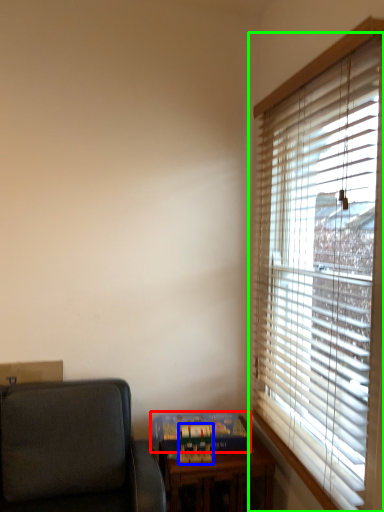
Question: Considering the real-world distances, which object is farthest from paperback book (highlighted by a red box)? paperback book (highlighted by a blue box) or window blind (highlighted by a green box)?

Choices:
 (A) paperback book
 (B) window blind

Answer: (B)